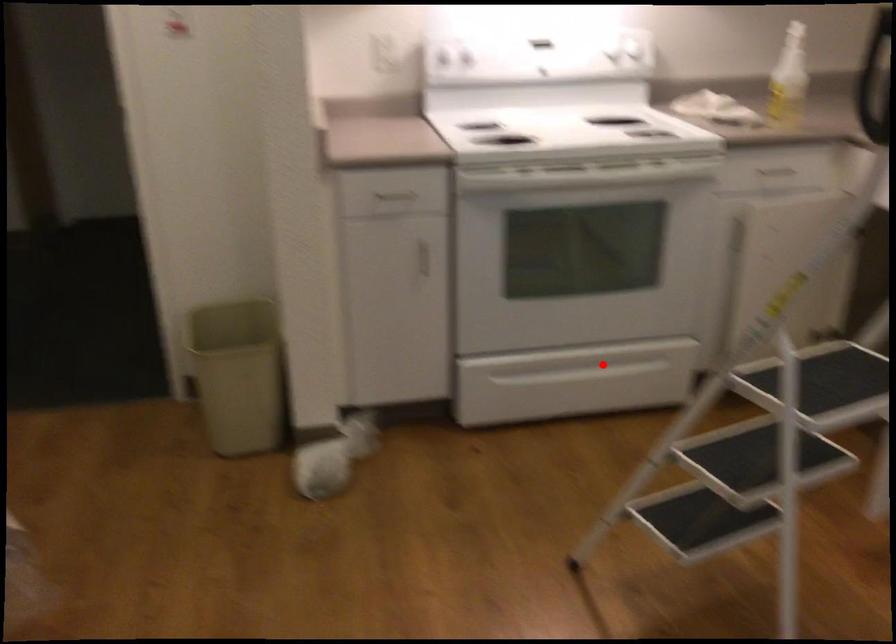
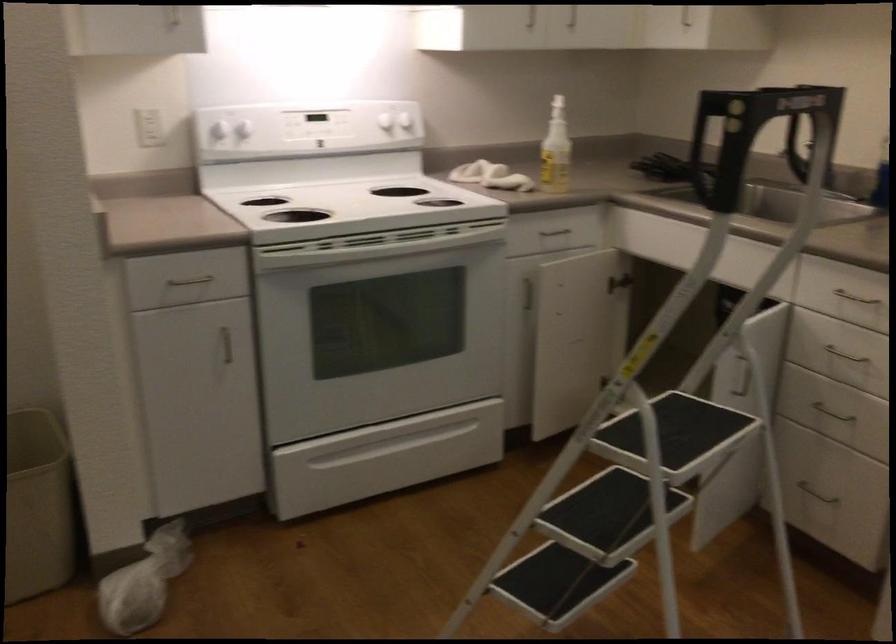
Question: I am providing you with two images of the same scene from different viewpoints. A red point is marked on the first image. Can you still see the location of the red point in image 2?

Choices:
 (A) Yes
 (B) No

Answer: (A)